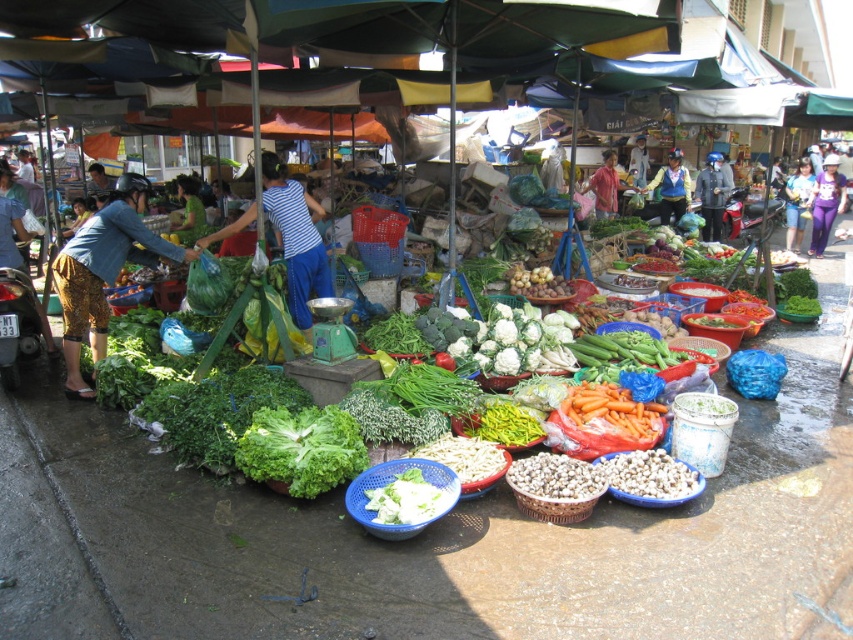
You are a delivery person carrying a heavy box and need to navigate through the market. The box is 2 meters long. Can you walk straight between the blue striped shirt at center and the red shirt at center without tilting the box sideways?

The distance between the blue striped shirt at center and the red shirt at center is 5.89 meters. Since the box is only 2 meters long, you can walk straight through the gap without tilting it sideways as there is sufficient space.